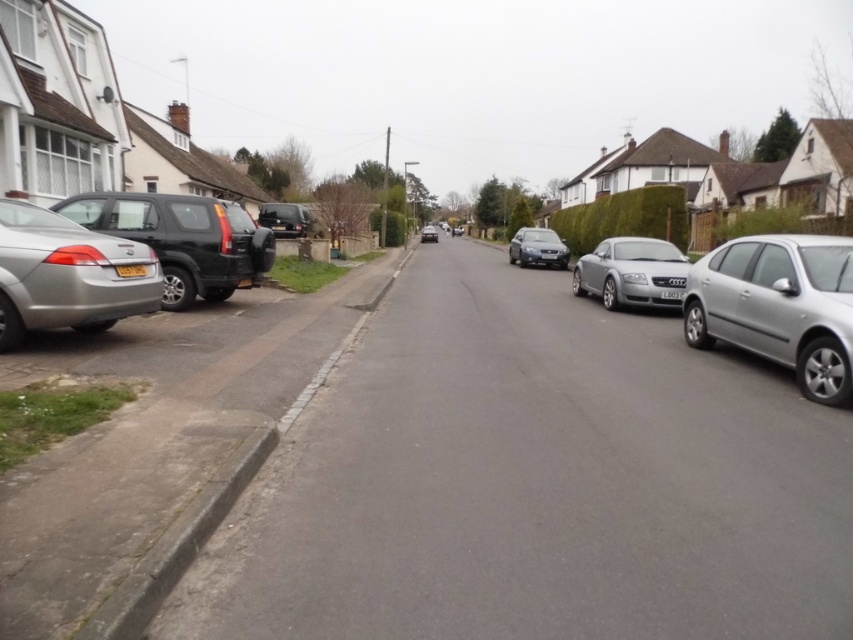
Question: Is the position of silver metallic sedan at right more distant than that of matte black suv at left?

Choices:
 (A) yes
 (B) no

Answer: (B)

Question: Which point is farther to the camera?

Choices:
 (A) silver metallic sedan at left
 (B) silver metallic sedan at right

Answer: (A)

Question: Does matte black suv at left appear over satin silver sedan at center?

Choices:
 (A) yes
 (B) no

Answer: (B)

Question: Which point is farther to the camera?

Choices:
 (A) satin silver sedan at center
 (B) white plastic license plate at center

Answer: (A)

Question: Which object is farther from the camera taking this photo?

Choices:
 (A) yellow matte license plate at center
 (B) white plastic license plate at center
 (C) matte black suv at left
 (D) shiny black suv at left

Answer: (B)

Question: Can you confirm if silver metallic sedan at right is bigger than satin silver car at center?

Choices:
 (A) yes
 (B) no

Answer: (B)